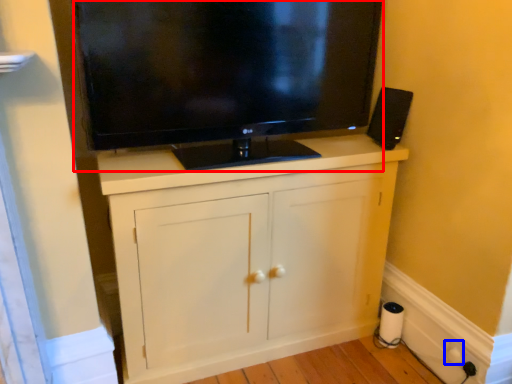
Question: Which object appears closest to the camera in this image, television (highlighted by a red box) or electric outlet (highlighted by a blue box)?

Choices:
 (A) television
 (B) electric outlet

Answer: (A)